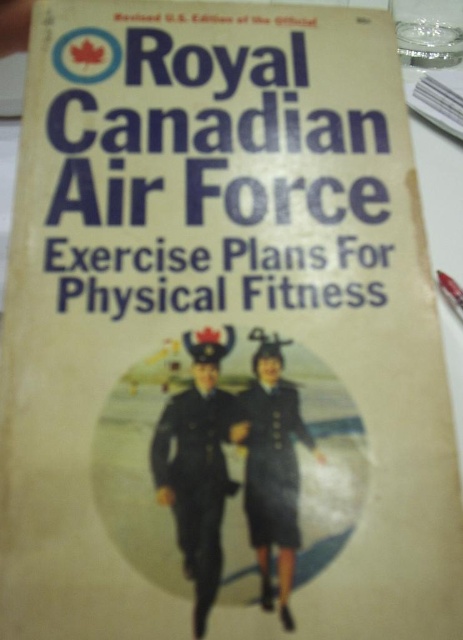
Looking at this image, you are a tailor who needs to determine which item requires more fabric between the dark blue uniform at center and the dark blue woolen dress at center. Based on the image, which one would need more fabric?

The dark blue uniform at center is larger in size than the dark blue woolen dress at center, so it would require more fabric.

You are a tailor trying to determine which item takes up more space horizontally in the image. Which one is wider between the dark blue uniform at center and the dark blue woolen dress at center?

The dark blue uniform at center is wider than dark blue woolen dress at center according to the description.